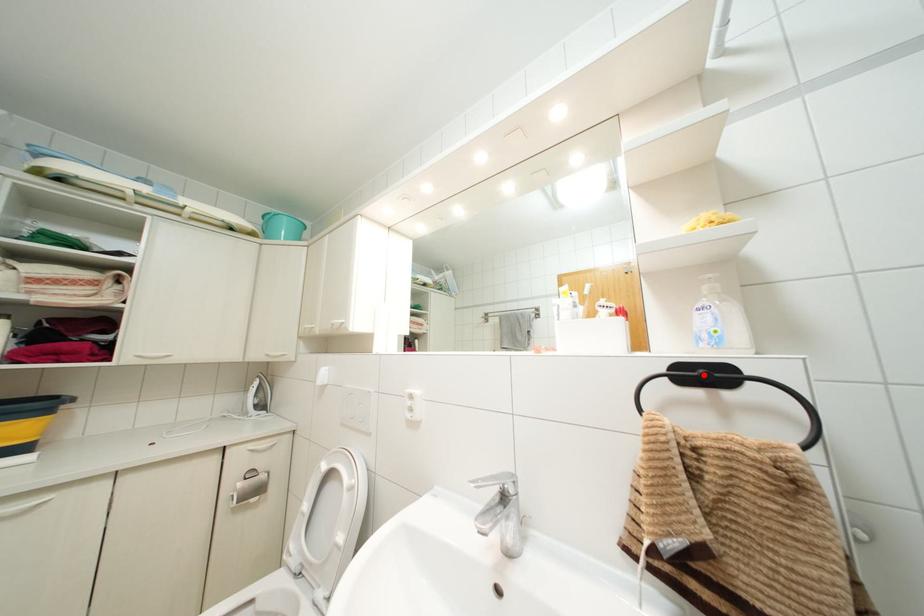
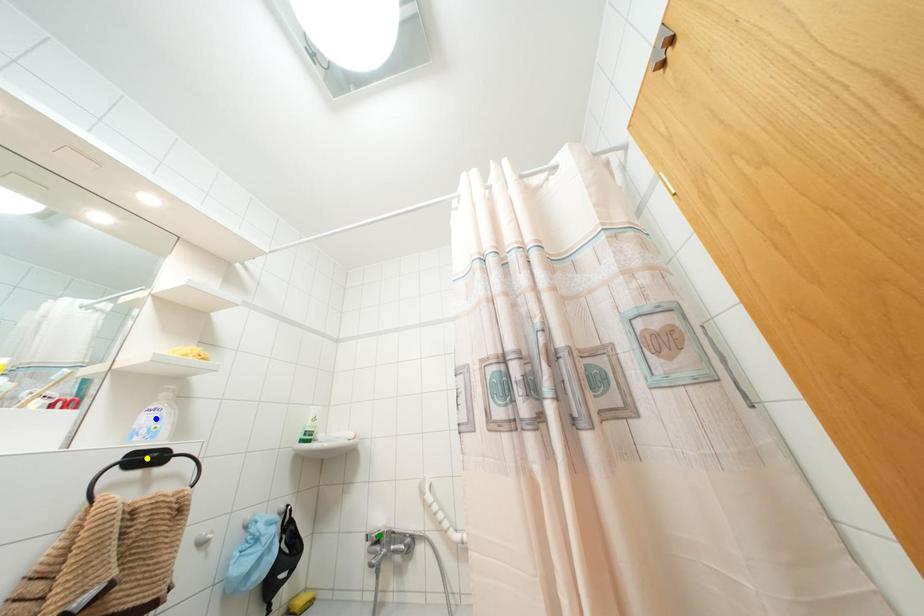
Question: I am providing you with two images of the same scene from different viewpoints. A red point is marked on the first image. You are given multiple points on the second image. Which mark in image 2 goes with the point in image 1?

Choices:
 (A) green point
 (B) blue point
 (C) yellow point

Answer: (C)